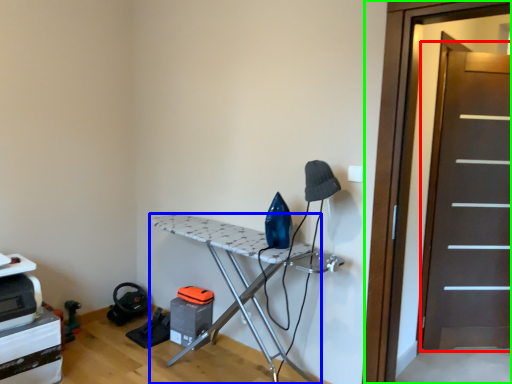
Question: Which is nearer to the screen door (highlighted by a red box)? furniture (highlighted by a blue box) or screen door (highlighted by a green box).

Choices:
 (A) furniture
 (B) screen door

Answer: (B)